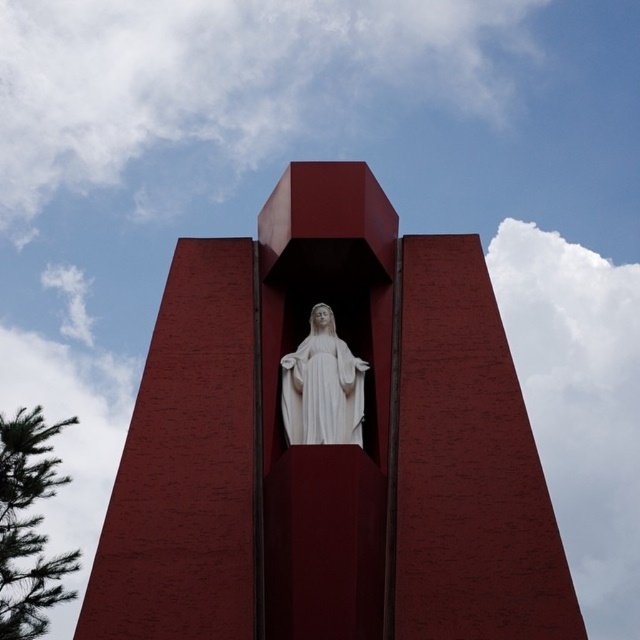
Question: Is matte red tower at center smaller than white marble statue at center?

Choices:
 (A) no
 (B) yes

Answer: (A)

Question: Which of the following is the closest to the observer?

Choices:
 (A) (401, 378)
 (B) (333, 372)

Answer: (B)

Question: Is matte red tower at center to the right of white marble statue at center from the viewer's perspective?

Choices:
 (A) yes
 (B) no

Answer: (B)

Question: Which point is closer to the camera taking this photo?

Choices:
 (A) (292, 170)
 (B) (285, 424)

Answer: (B)

Question: Does matte red tower at center appear over white marble statue at center?

Choices:
 (A) yes
 (B) no

Answer: (B)

Question: Which point is farther to the camera?

Choices:
 (A) (538, 586)
 (B) (326, 388)

Answer: (B)